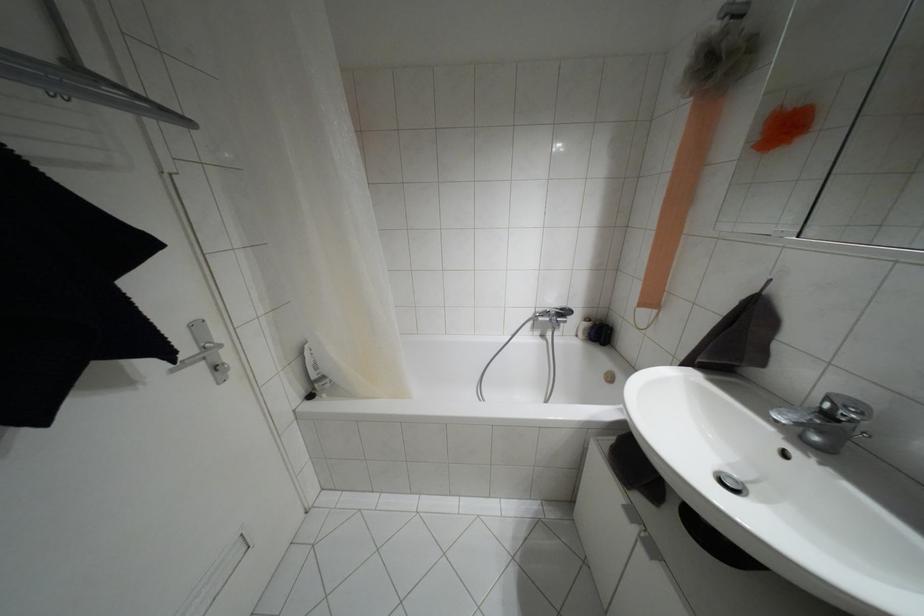
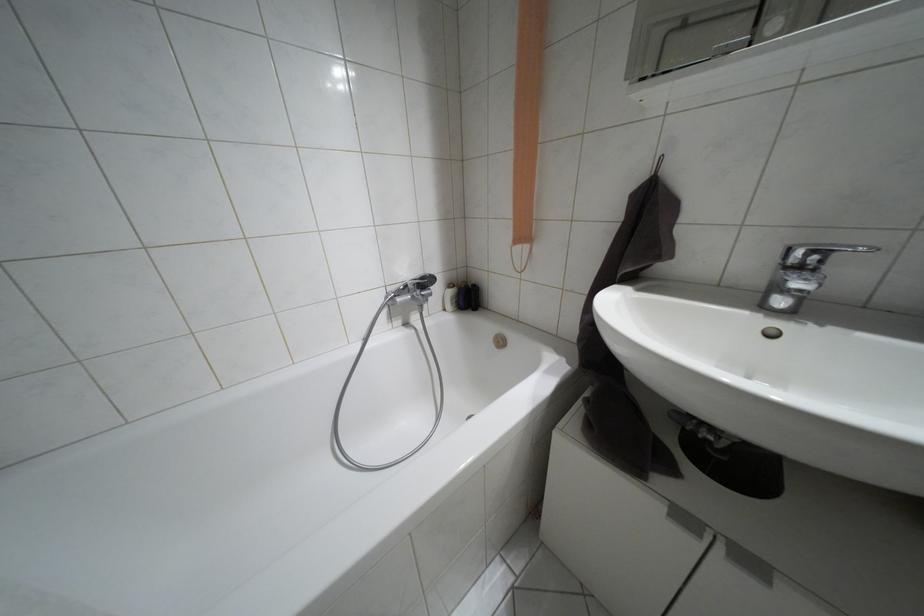
Find the pixel in the second image that matches (x=631, y=513) in the first image.

(684, 517)